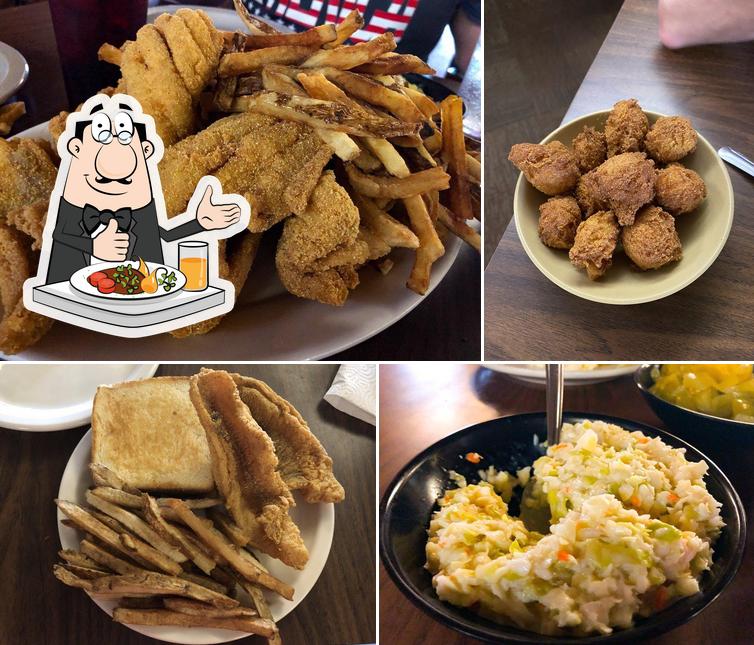
Identify the location of plate. This screenshot has width=754, height=645. (307, 328), (60, 380), (314, 524), (529, 378), (8, 63).